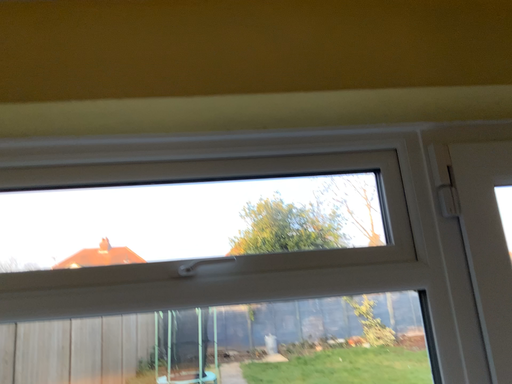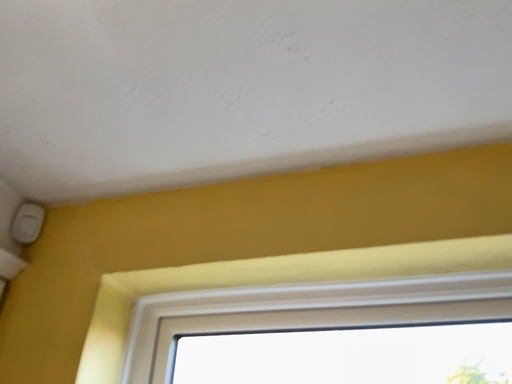
Question: Which way did the camera rotate in the video?

Choices:
 (A) rotated downward
 (B) rotated upward

Answer: (B)